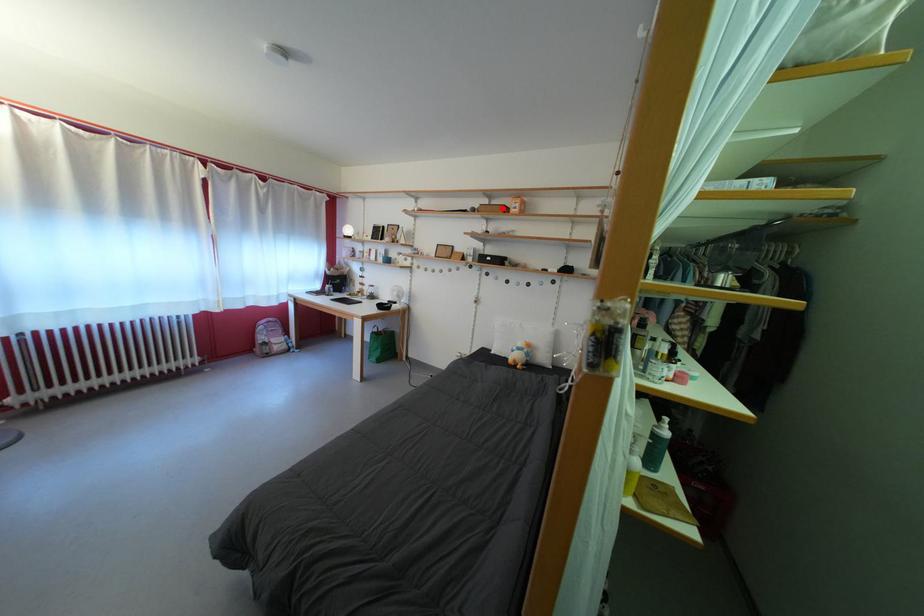
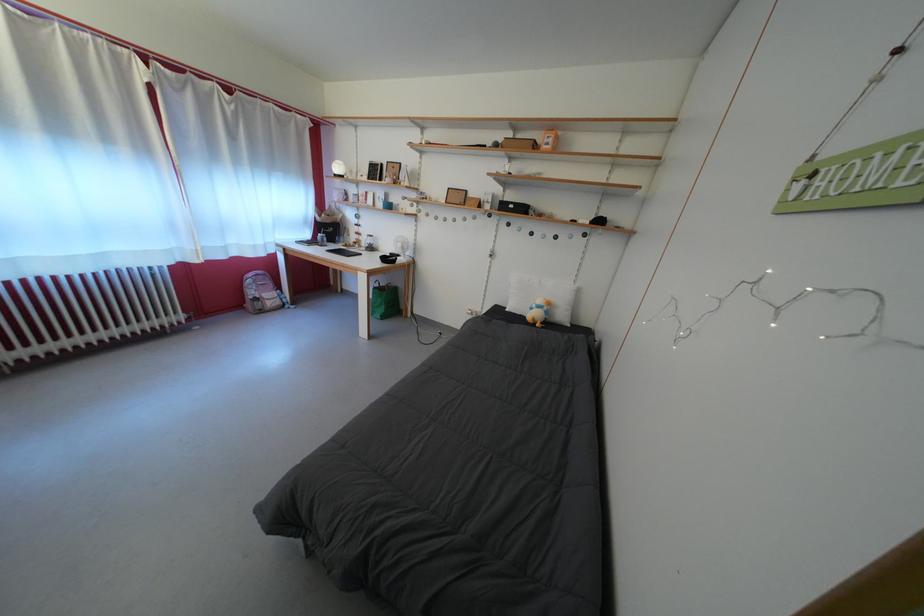
In the second image, find the point that corresponds to the highlighted location in the first image.

(527, 142)